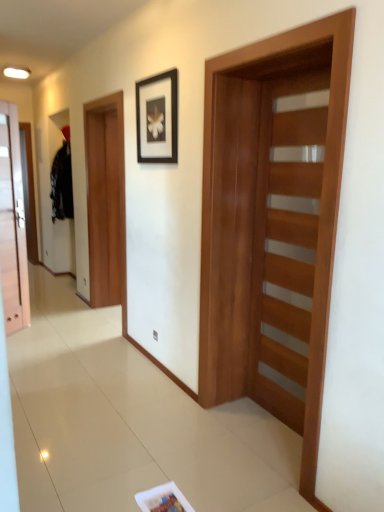
Question: Would you say white glossy magazine at lower center is to the left or to the right of brown wooden door at left, which is counted as the 1th barn door, starting from the back, in the picture?

Choices:
 (A) right
 (B) left

Answer: (A)

Question: Would you say white glossy magazine at lower center is inside or outside brown wooden door at left, the 1th barn door in the left-to-right sequence?

Choices:
 (A) inside
 (B) outside

Answer: (B)

Question: Which object is positioned farthest from the brown wooden door at left, which is counted as the 1th barn door, starting from the back?

Choices:
 (A) matte wood door at left, arranged as the 2th door when viewed from the front
 (B) wooden door at right, the first door positioned from the front
 (C) black matte picture frame at upper center
 (D) wooden barn door at center, acting as the second barn door starting from the back
 (E) white glossy magazine at lower center

Answer: (E)

Question: Which object is the closest to the matte wood door at left, arranged as the 2th door when viewed from the front?

Choices:
 (A) black matte picture frame at upper center
 (B) wooden door at right, marked as the 1th door in a right-to-left arrangement
 (C) white glossy magazine at lower center
 (D) brown wooden door at left, which is counted as the 1th barn door, starting from the back
 (E) wooden barn door at center, which ranks as the first barn door in right-to-left order

Answer: (D)